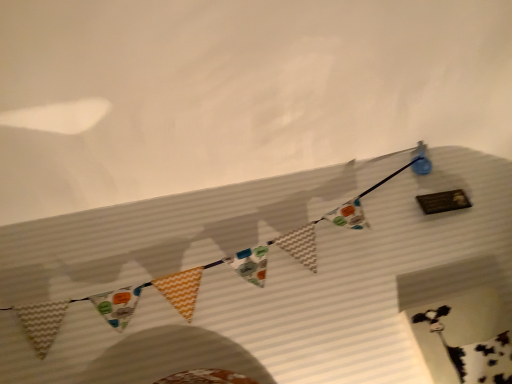
This screenshot has height=384, width=512. Find the location of `printed fabric flags at center`. printed fabric flags at center is located at coordinates (199, 274).

In order to face printed fabric flags at center, should I rotate leftwards or rightwards?

To face it directly, rotate left by 1.455 degrees.

What is the approximate height of printed fabric flags at center?

printed fabric flags at center is 41.28 centimeters in height.

Describe the element at coordinates (199, 274) in the screenshot. I see `printed fabric flags at center` at that location.

The image size is (512, 384). Find the location of `printed fabric flags at center`. printed fabric flags at center is located at coordinates (199, 274).